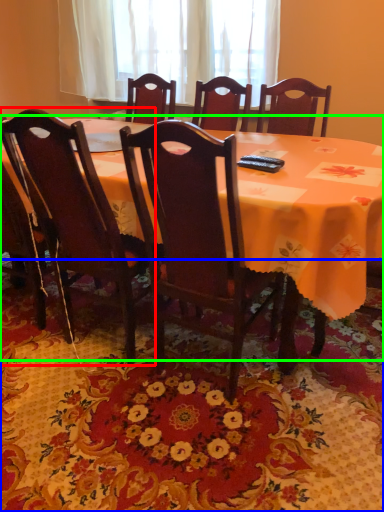
Question: Which object is the farthest from chair (highlighted by a red box)? Choose among these: mat (highlighted by a blue box) or table (highlighted by a green box).

Choices:
 (A) mat
 (B) table

Answer: (B)